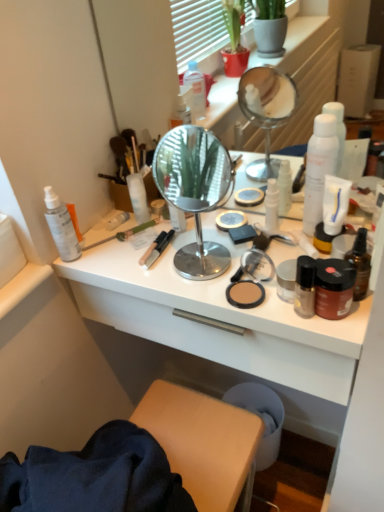
At what (x,y) coordinates should I click in order to perform the action: click on vacant area situated to the left side of white glossy bottle at center, which is the 4th toiletry in right-to-left order. Please return your answer as a coordinate pair (x, y). Looking at the image, I should click on (199, 240).